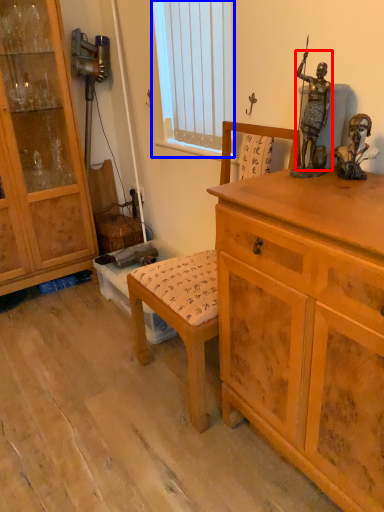
Question: Which object appears closest to the camera in this image, person (highlighted by a red box) or window screen (highlighted by a blue box)?

Choices:
 (A) person
 (B) window screen

Answer: (A)